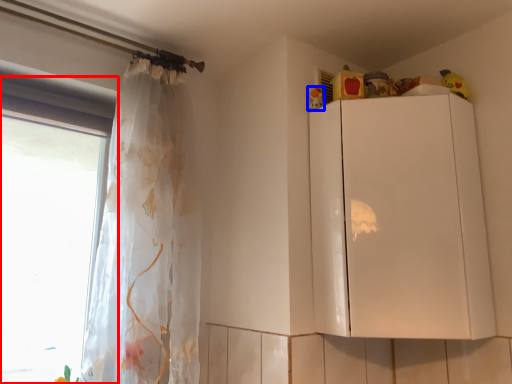
Question: Which object is further to the camera taking this photo, window (highlighted by a red box) or toy (highlighted by a blue box)?

Choices:
 (A) window
 (B) toy

Answer: (B)